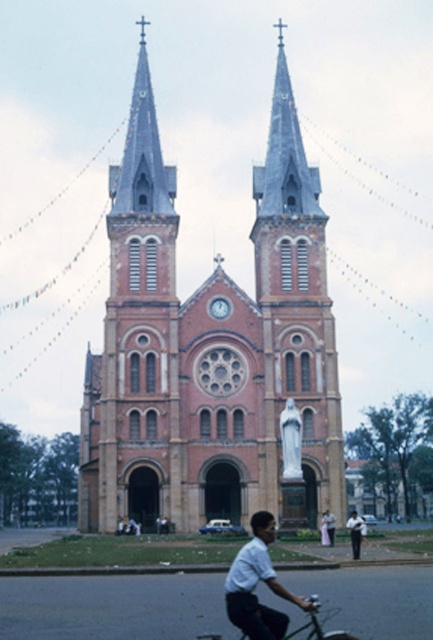
In the scene shown: Can you confirm if brown brick church at center is wider than white matte shirt at lower center?

Correct, the width of brown brick church at center exceeds that of white matte shirt at lower center.

You are a GUI agent. You are given a task and a screenshot of the screen. Output one action in this format:
    pyautogui.click(x=<x>, y=<y>)
    Task: Click on the brown brick church at center
    This screenshot has width=433, height=640.
    Given the screenshot: What is the action you would take?
    pyautogui.click(x=210, y=348)

Who is taller, brown brick church at center or metallic silver bicycle at lower center?

Standing taller between the two is brown brick church at center.

Who is more distant from viewer, (219, 458) or (306, 624)?

The point (219, 458) is behind.

Measure the distance between point (232, 419) and camera.

Point (232, 419) and camera are 100.63 meters apart from each other.

The width and height of the screenshot is (433, 640). Identify the location of brown brick church at center. (210, 348).

This screenshot has width=433, height=640. What do you see at coordinates (210, 348) in the screenshot?
I see `brown brick church at center` at bounding box center [210, 348].

Is point (217, 317) farther from viewer compared to point (352, 529)?

Yes.

What are the coordinates of `brown brick church at center` in the screenshot? It's located at (210, 348).

Locate an element on the screen. The width and height of the screenshot is (433, 640). brown brick church at center is located at coordinates (210, 348).